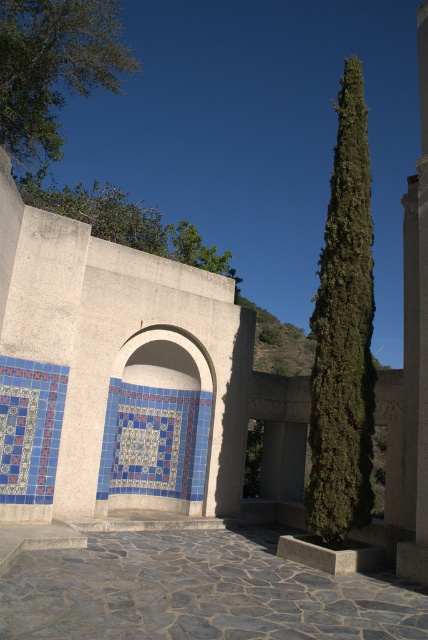
Is green leafy tree at upper left below green leafy tree at upper center?

Actually, green leafy tree at upper left is above green leafy tree at upper center.

Between point (98, 33) and point (157, 227), which one is positioned in front?

Point (98, 33) is more forward.

Locate an element on the screen. The width and height of the screenshot is (428, 640). green leafy tree at upper left is located at coordinates (53, 67).

Measure the distance between point (166,372) and camera.

Point (166,372) and camera are 11.45 meters apart from each other.

Does point (133, 369) lie in front of point (56, 54)?

Yes.

Locate an element on the screen. Image resolution: width=428 pixels, height=640 pixels. blue mosaic tile arch at center is located at coordinates (157, 422).

The width and height of the screenshot is (428, 640). Identify the location of blue mosaic tile arch at center. (157, 422).

I want to click on white stone pillar at right, so click(416, 340).

Is white stone pillar at right below green leafy tree at upper center?

Incorrect, white stone pillar at right is not positioned below green leafy tree at upper center.

Who is more forward, (425, 396) or (100, 236)?

Point (425, 396) is more forward.

This screenshot has width=428, height=640. Find the location of `white stone pillar at right`. white stone pillar at right is located at coordinates (416, 340).